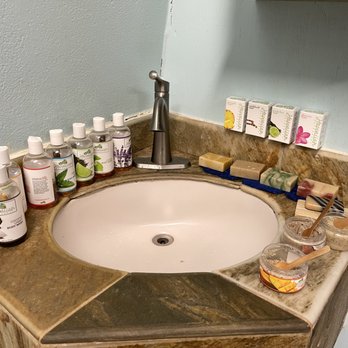
This screenshot has height=348, width=348. Identify the location of back edge of  vanity. (140, 132), (178, 137), (311, 167).